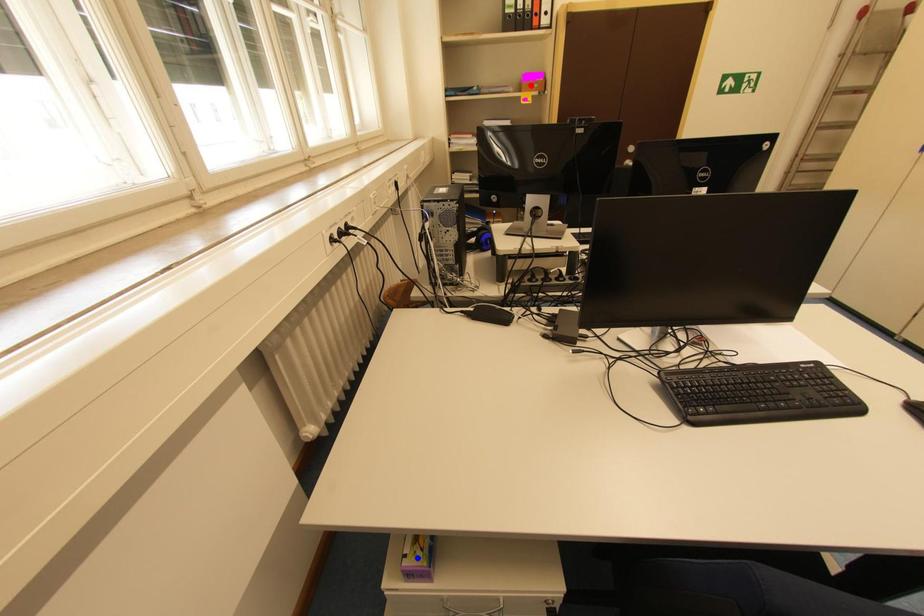
Question: Which of the two points in the image is closer to the camera?

Choices:
 (A) Blue point is closer.
 (B) Red point is closer.

Answer: (A)